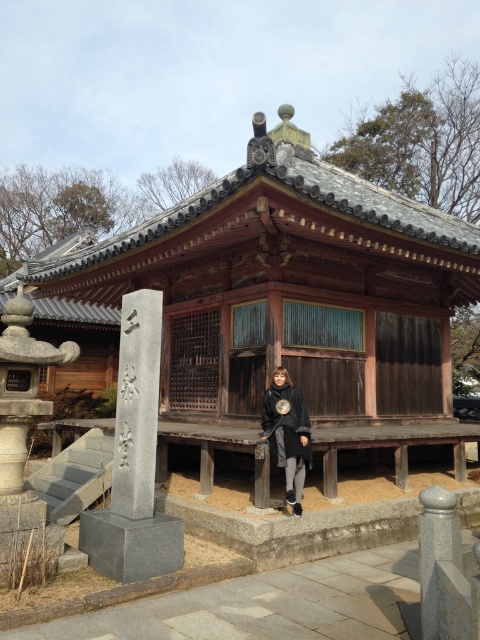
Question: Which object appears closest to the camera in this image?

Choices:
 (A) black matte jacket at center
 (B) gray stone pillar at left
 (C) gray stone pillar at lower right
 (D) wooden at center

Answer: (C)

Question: Observing the image, what is the correct spatial positioning of black matte jacket at center in reference to gray stone pillar at lower right?

Choices:
 (A) above
 (B) below

Answer: (A)

Question: Does black matte jacket at center come behind gray stone pillar at lower right?

Choices:
 (A) no
 (B) yes

Answer: (B)

Question: Does black matte jacket at center come behind gray stone pillar at lower right?

Choices:
 (A) no
 (B) yes

Answer: (B)

Question: Which point is closer to the camera?

Choices:
 (A) (429, 582)
 (B) (297, 456)
 (C) (443, 280)

Answer: (A)

Question: Which object appears closest to the camera in this image?

Choices:
 (A) gray stone pillar at left
 (B) black matte jacket at center

Answer: (A)